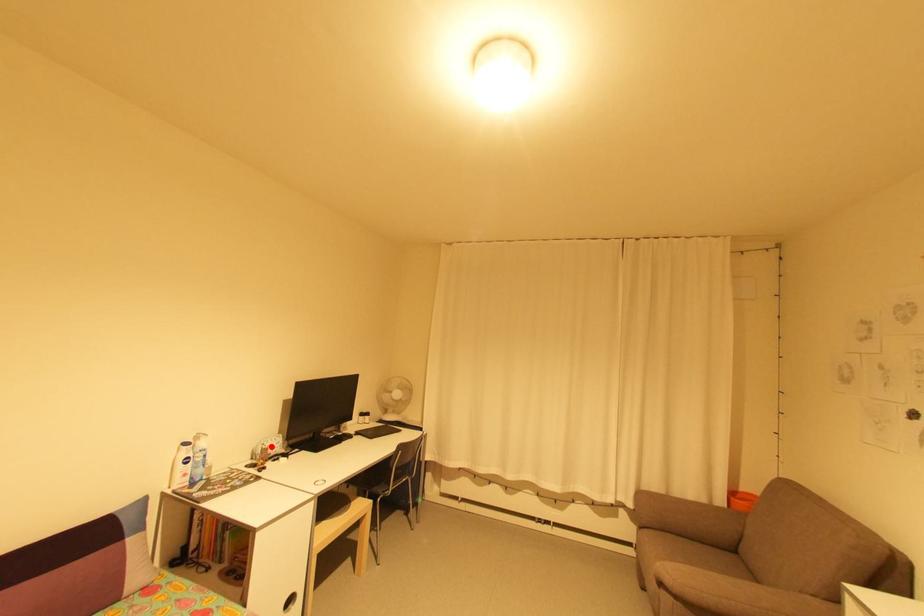
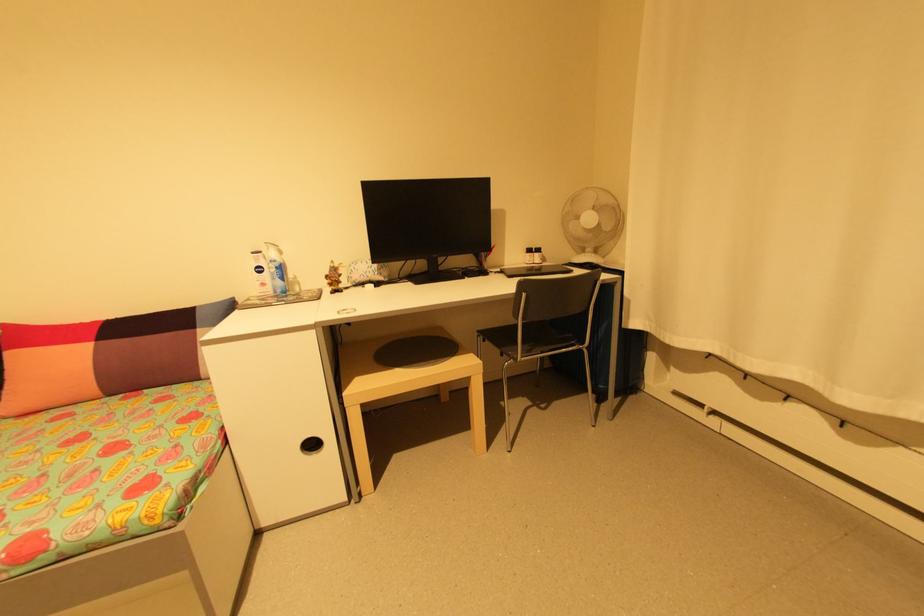
In the second image, find the point that corresponds to the highlighted location in the first image.

(341, 265)